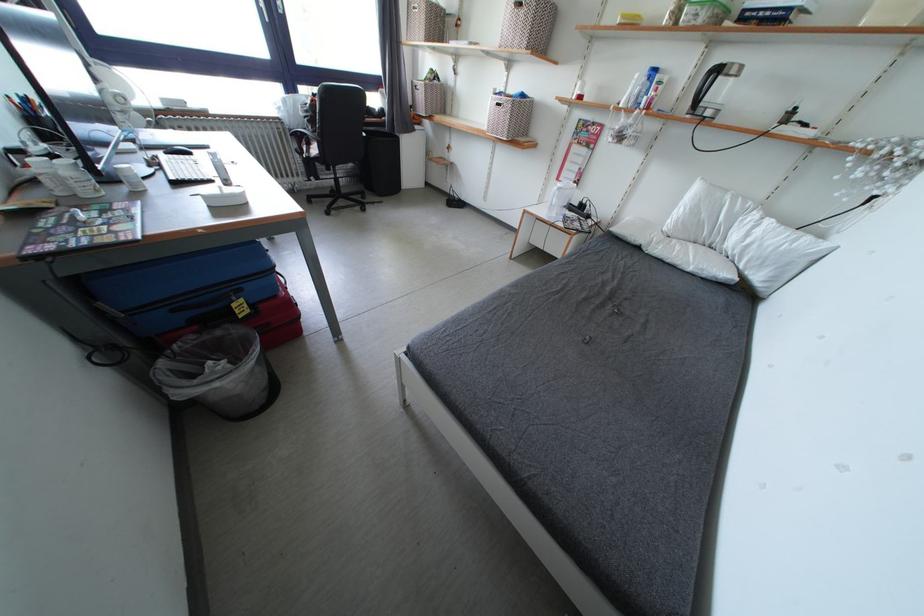
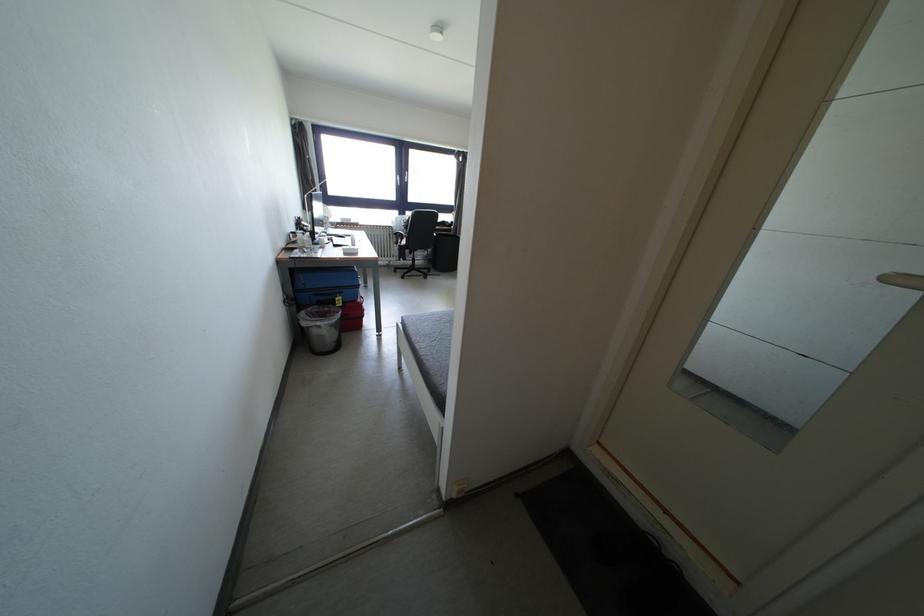
In the second image, find the point that corresponds to [293,127] in the first image.

(400, 233)